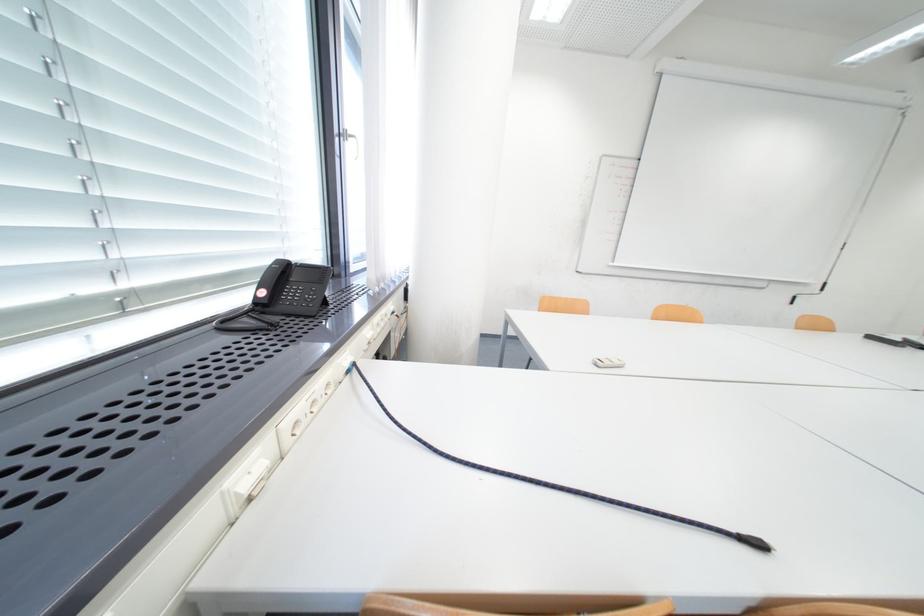
The height and width of the screenshot is (616, 924). What do you see at coordinates (347, 136) in the screenshot? I see `the white window handle` at bounding box center [347, 136].